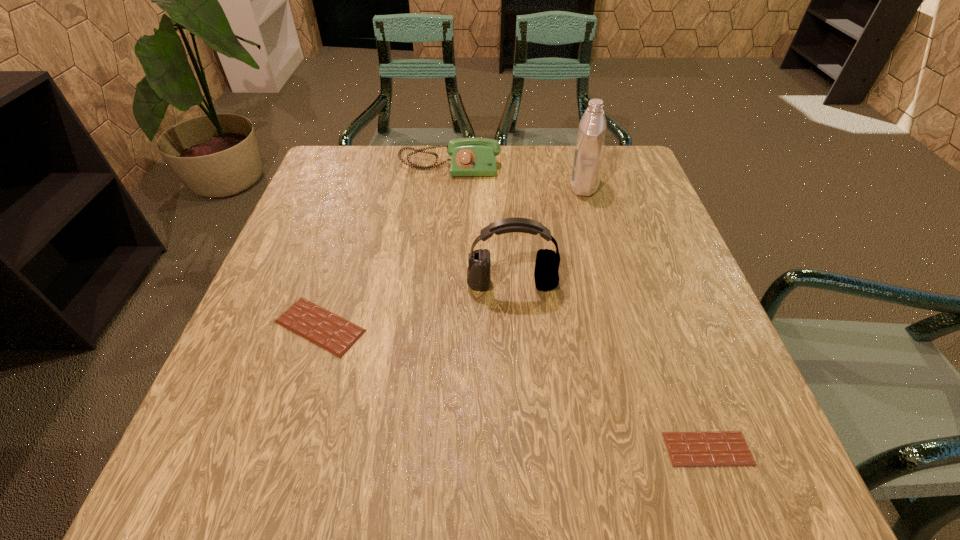
I want to click on free space between the third farthest object and the nearer chocolate bar, so click(610, 366).

Locate an element on the screen. The image size is (960, 540). blank region between the telephone and the nearest object is located at coordinates (579, 308).

This screenshot has width=960, height=540. Find the location of `empty space that is in between the nearest object and the tallest object`. empty space that is in between the nearest object and the tallest object is located at coordinates (646, 318).

The width and height of the screenshot is (960, 540). In order to click on vacant area that lies between the telephone and the nearer chocolate bar in this screenshot , I will do `click(579, 308)`.

Find the location of a particular element. This screenshot has height=540, width=960. vacant region between the fourth shortest object and the fourth farthest object is located at coordinates (416, 305).

This screenshot has height=540, width=960. What are the coordinates of `vacant space in between the farther chocolate bar and the second tallest object` in the screenshot? It's located at (416, 305).

Identify the location of vacant point located between the farther chocolate bar and the third tallest object. (385, 247).

The image size is (960, 540). Identify the location of object that can be found as the second closest to the taller chocolate bar. 469,156.

At what (x,y) coordinates should I click in order to perform the action: click on the second closest object to the third shortest object. Please return your answer as a coordinate pair (x, y). Looking at the image, I should click on (546, 275).

Image resolution: width=960 pixels, height=540 pixels. Identify the location of free space that satisfies the following two spatial constraints: 1. on the dial of the telephone; 2. on the right side of the tallest object. pos(448,186).